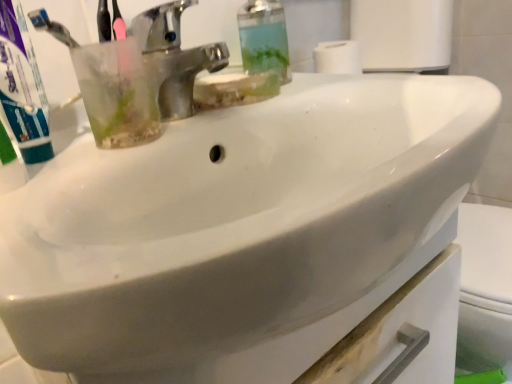
Where is `spots to the right of transparent plastic soap dispenser at upper center`? spots to the right of transparent plastic soap dispenser at upper center is located at coordinates (336, 79).